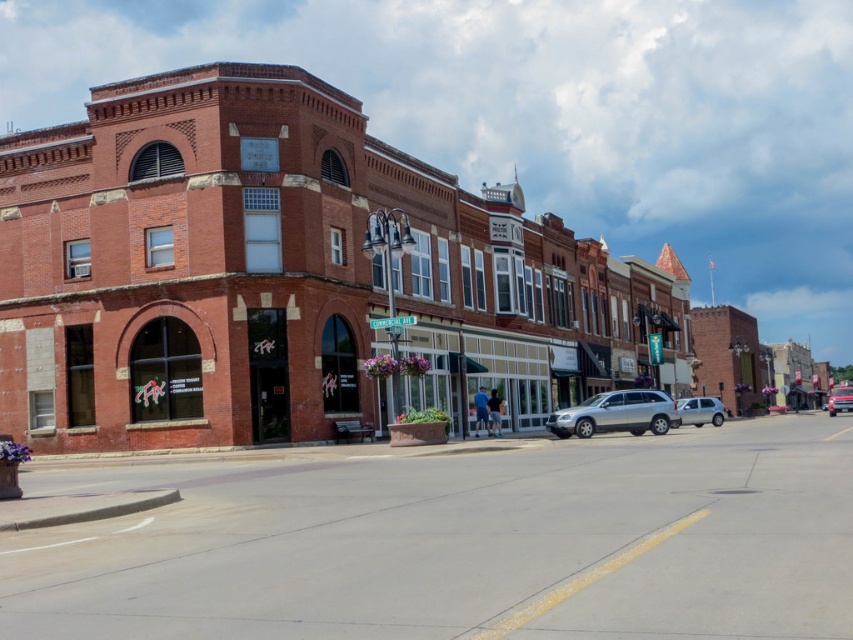
You are standing on the sidewalk in front of the historic brick building. You see two points marked on the ground at coordinates point (x=119, y=340) and point (x=595, y=406). Which point is closer to you?

Point (x=119, y=340) is closer to you because it is closer to the camera than point (x=595, y=406).

You are standing at the center of the street in the image. You see a point marked at coordinate (700, 410). Which object is this point located on?

The point at coordinate (700, 410) is located on the satin silver suv at center right.